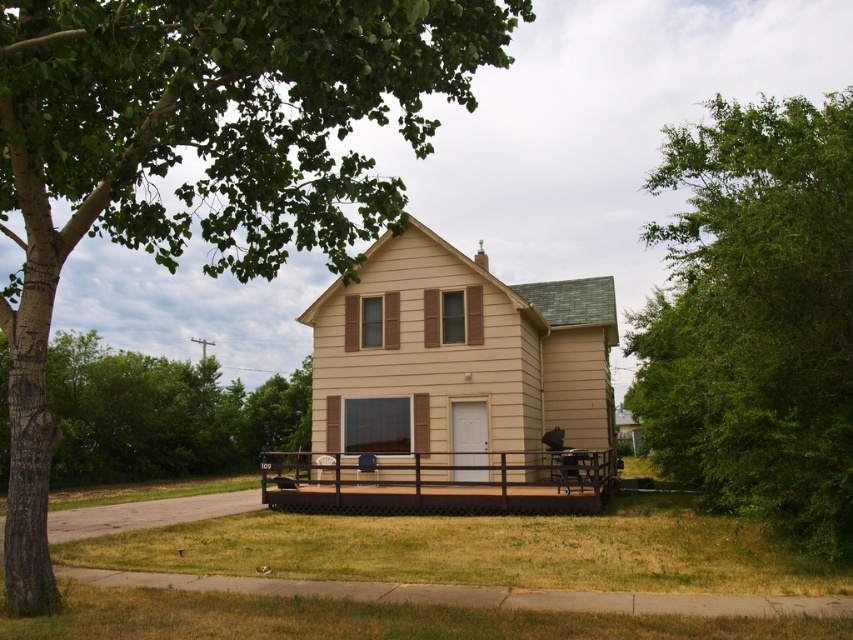
You are standing in front of the house and want to walk to both the point at coordinates (312, 182) and the point at coordinates (575, 467). Which point will you reach first?

You will reach the point at coordinates (312, 182) first because it is closer to you than the point at coordinates (575, 467).

You are planning to host a small gathering in your backyard and want to ensure there is enough space for all the guests. Given the green leafy tree at lower left and the matte black chair at center, which object takes up more space in the scene?

The green leafy tree at lower left has a larger size compared to the matte black chair at center, so it takes up more space in the scene.